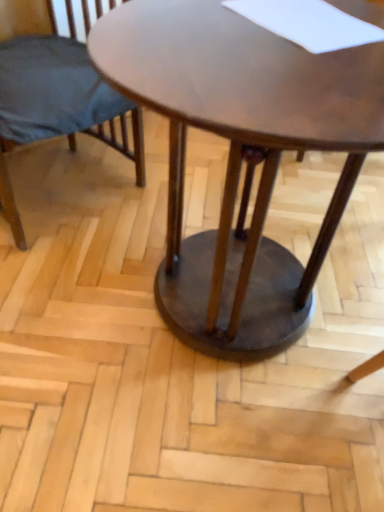
Question: From the image's perspective, is matte dark blue fabric chair at left located above shiny brown wood coffee table at center?

Choices:
 (A) yes
 (B) no

Answer: (A)

Question: Does matte dark blue fabric chair at left come behind shiny brown wood coffee table at center?

Choices:
 (A) no
 (B) yes

Answer: (B)

Question: Is matte dark blue fabric chair at left bigger than shiny brown wood coffee table at center?

Choices:
 (A) no
 (B) yes

Answer: (A)

Question: Does matte dark blue fabric chair at left appear on the right side of shiny brown wood coffee table at center?

Choices:
 (A) no
 (B) yes

Answer: (A)

Question: Can shiny brown wood coffee table at center be found inside matte dark blue fabric chair at left?

Choices:
 (A) no
 (B) yes

Answer: (A)

Question: Is there a large distance between matte dark blue fabric chair at left and shiny brown wood coffee table at center?

Choices:
 (A) yes
 (B) no

Answer: (B)

Question: From a real-world perspective, does shiny brown wood coffee table at center sit lower than matte dark blue fabric chair at left?

Choices:
 (A) no
 (B) yes

Answer: (A)

Question: Does shiny brown wood coffee table at center have a lesser width compared to matte dark blue fabric chair at left?

Choices:
 (A) yes
 (B) no

Answer: (B)

Question: Considering the relative sizes of shiny brown wood coffee table at center and matte dark blue fabric chair at left in the image provided, is shiny brown wood coffee table at center smaller than matte dark blue fabric chair at left?

Choices:
 (A) yes
 (B) no

Answer: (B)

Question: Does shiny brown wood coffee table at center have a greater height compared to matte dark blue fabric chair at left?

Choices:
 (A) no
 (B) yes

Answer: (B)

Question: Considering the relative positions of shiny brown wood coffee table at center and matte dark blue fabric chair at left in the image provided, is shiny brown wood coffee table at center to the right of matte dark blue fabric chair at left from the viewer's perspective?

Choices:
 (A) no
 (B) yes

Answer: (B)

Question: Does shiny brown wood coffee table at center have a lesser height compared to matte dark blue fabric chair at left?

Choices:
 (A) no
 (B) yes

Answer: (A)

Question: Considering their positions, is matte dark blue fabric chair at left located in front of or behind shiny brown wood coffee table at center?

Choices:
 (A) front
 (B) behind

Answer: (B)